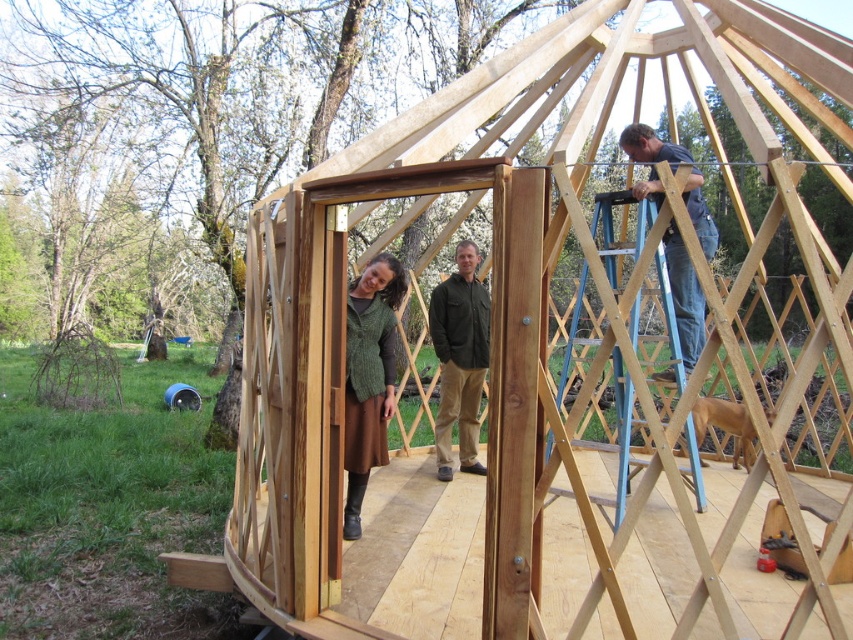
Does green knitted sweater at center have a lesser width compared to green matte jacket at center?

Yes.

Does green knitted sweater at center appear on the left side of green matte jacket at center?

Correct, you'll find green knitted sweater at center to the left of green matte jacket at center.

Between point (360, 451) and point (463, 280), which one is positioned behind?

The point (463, 280) is behind.

Locate an element on the screen. The height and width of the screenshot is (640, 853). green knitted sweater at center is located at coordinates (369, 376).

Can you confirm if knitted green sweater at center is positioned below green matte jacket at center?

Yes.

Can you confirm if knitted green sweater at center is thinner than green matte jacket at center?

Indeed, knitted green sweater at center has a lesser width compared to green matte jacket at center.

Who is more distant from viewer, (375,273) or (485,470)?

Point (485,470)

The image size is (853, 640). I want to click on knitted green sweater at center, so click(466, 356).

Does point (469, 260) lie behind point (347, 438)?

That is True.

This screenshot has height=640, width=853. In order to click on knitted green sweater at center in this screenshot , I will do pyautogui.click(x=466, y=356).

Find the location of a particular element. The height and width of the screenshot is (640, 853). knitted green sweater at center is located at coordinates (466, 356).